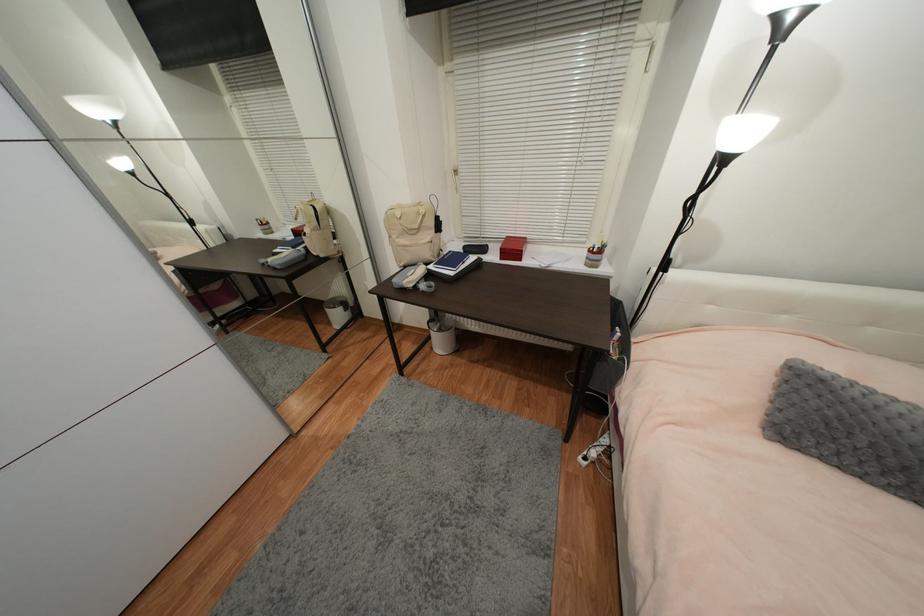
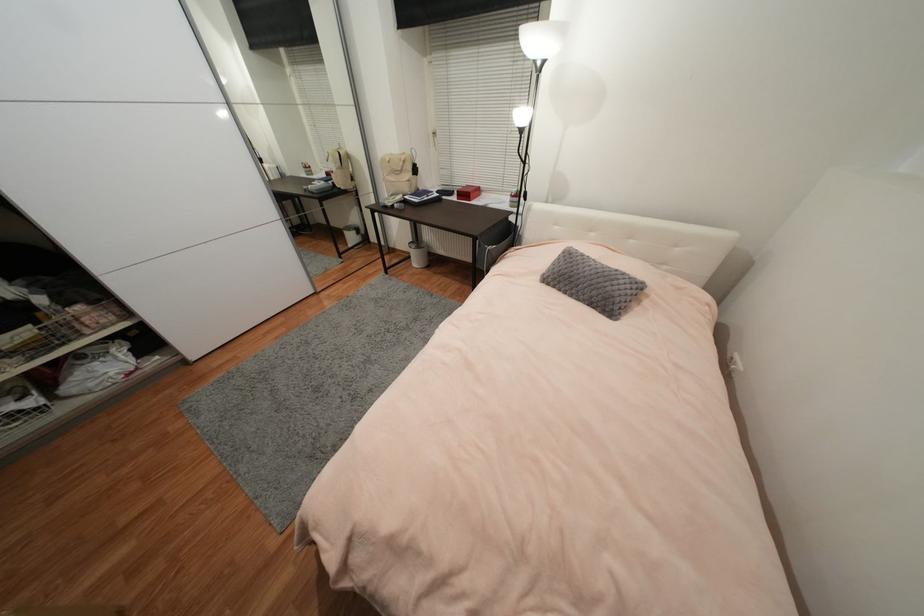
Find the pixel in the second image that matches (432,256) in the first image.

(410, 191)